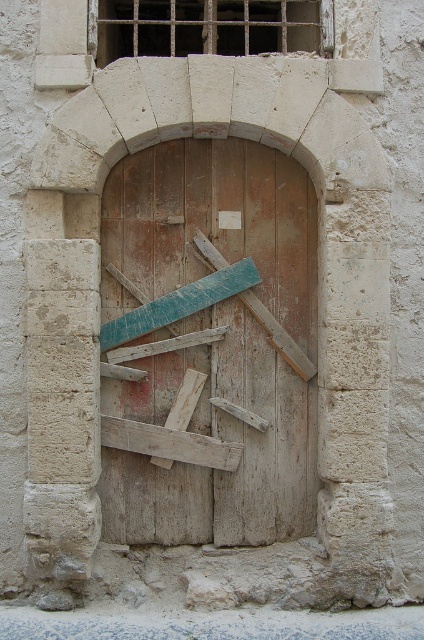
Question: Which of the following is the farthest from the observer?

Choices:
 (A) (268, 387)
 (B) (253, 269)

Answer: (A)

Question: Can you confirm if weathered wood door at center is positioned to the right of teal wood plank at center?

Choices:
 (A) yes
 (B) no

Answer: (A)

Question: Does weathered wood door at center appear over teal wood plank at center?

Choices:
 (A) yes
 (B) no

Answer: (B)

Question: Does weathered wood door at center have a lesser width compared to teal wood plank at center?

Choices:
 (A) yes
 (B) no

Answer: (B)

Question: Among these objects, which one is nearest to the camera?

Choices:
 (A) weathered wood door at center
 (B) teal wood plank at center

Answer: (B)

Question: Which object appears closest to the camera in this image?

Choices:
 (A) teal wood plank at center
 (B) weathered wood door at center

Answer: (A)